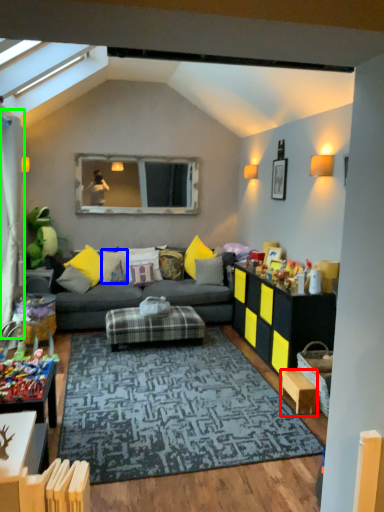
Question: Based on their relative distances, which object is nearer to table (highlighted by a red box)? Choose from pillow (highlighted by a blue box) and curtain (highlighted by a green box).

Choices:
 (A) pillow
 (B) curtain

Answer: (A)